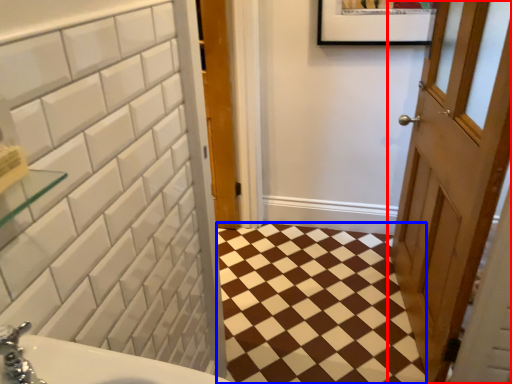
Question: Which point is further to the camera, door (highlighted by a red box) or ceramic tile (highlighted by a blue box)?

Choices:
 (A) door
 (B) ceramic tile

Answer: (B)